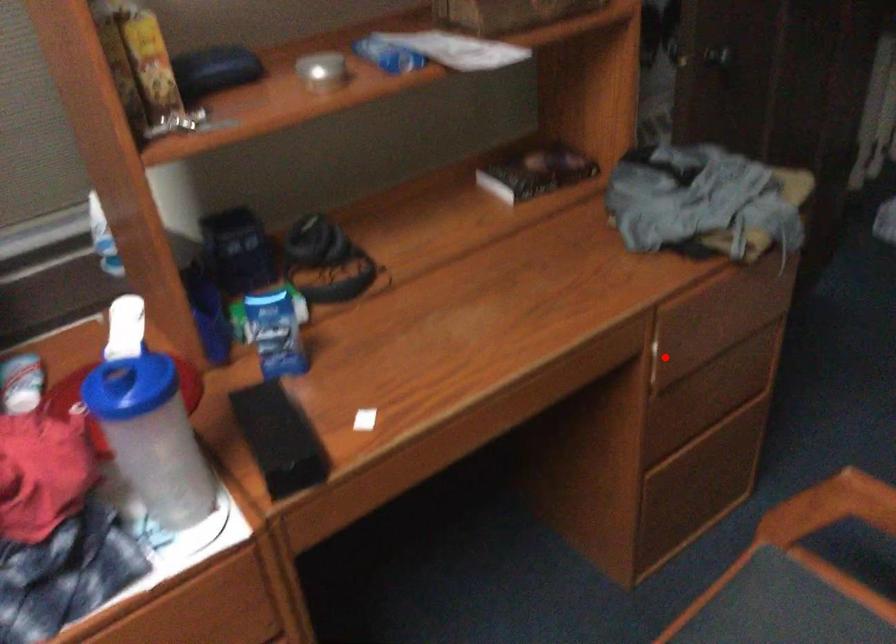
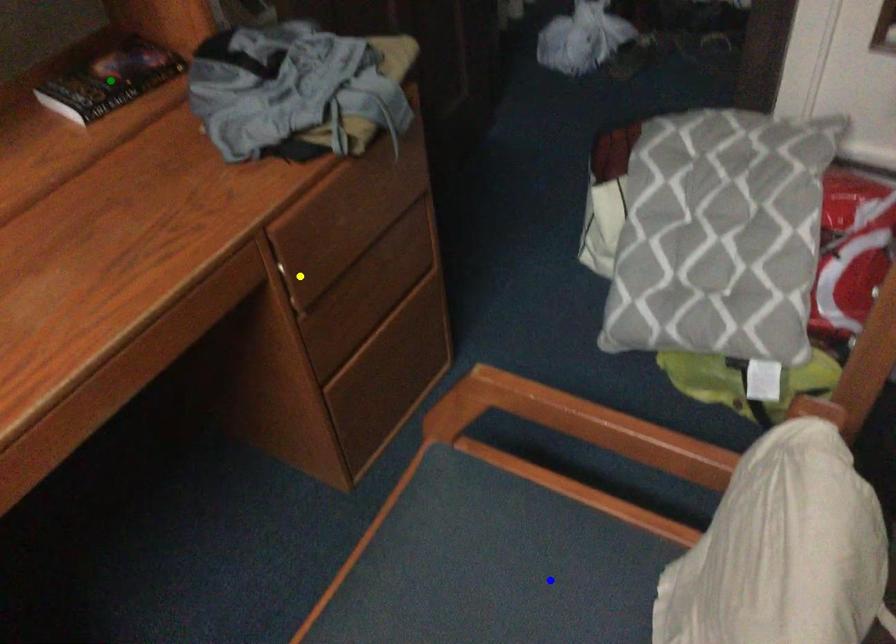
Question: I am providing you with two images of the same scene from different viewpoints. A red point is marked on the first image. You are given multiple points on the second image. Which spot in image 2 lines up with the point in image 1?

Choices:
 (A) blue point
 (B) green point
 (C) yellow point

Answer: (C)